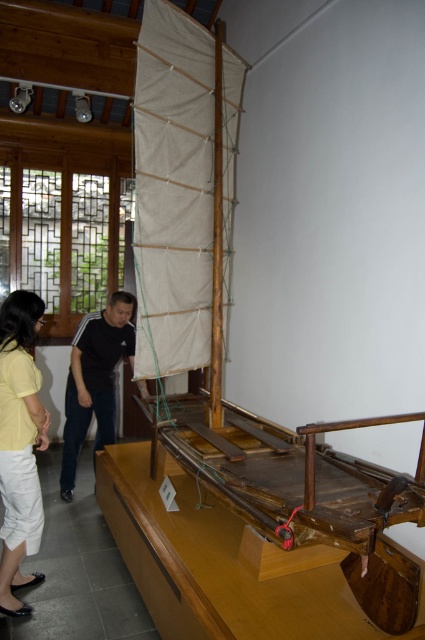
Between point (17, 451) and point (113, 304), which one is positioned behind?

The point (113, 304) is more distant.

Between yellow cotton shirt at lower left and black cotton shirt at center, which one appears on the left side from the viewer's perspective?

yellow cotton shirt at lower left

Who is more distant from viewer, (5,608) or (124,356)?

Point (124,356)

The height and width of the screenshot is (640, 425). I want to click on yellow cotton shirt at lower left, so click(x=19, y=444).